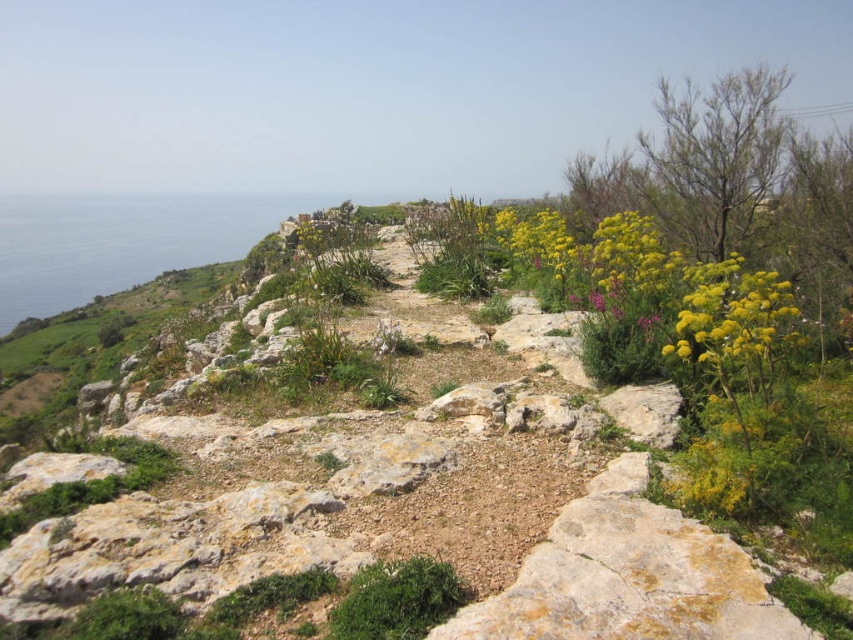
Does yellow fluffy plant at right have a lesser width compared to yellow fluffy plant at upper right?

No.

Is point (784, 330) positioned before point (735, 253)?

Yes, point (784, 330) is in front of point (735, 253).

At what (x,y) coordinates should I click in order to perform the action: click on yellow fluffy plant at right. Please return your answer as a coordinate pair (x, y). The width and height of the screenshot is (853, 640). Looking at the image, I should click on (653, 285).

Who is more distant from viewer, (134,198) or (695,324)?

The point (134,198) is behind.

At what (x,y) coordinates should I click in order to perform the action: click on blue water at left. Please return your answer as a coordinate pair (x, y). Looking at the image, I should click on (122, 241).

Who is more forward, (221, 220) or (778, 340)?

Point (778, 340) is more forward.

Locate an element on the screen. blue water at left is located at coordinates (122, 241).

Who is positioned more to the right, yellow fluffy plant at right or green leafy bush at lower center?

yellow fluffy plant at right

This screenshot has height=640, width=853. Describe the element at coordinates (653, 285) in the screenshot. I see `yellow fluffy plant at right` at that location.

Is point (677, 307) behind point (453, 570)?

Yes.

This screenshot has height=640, width=853. In order to click on yellow fluffy plant at right in this screenshot , I will do `click(653, 285)`.